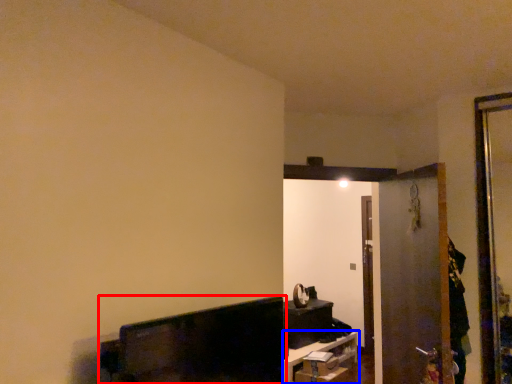
Question: Which object appears closest to the camera in this image, furniture (highlighted by a red box) or furniture (highlighted by a blue box)?

Choices:
 (A) furniture
 (B) furniture

Answer: (A)